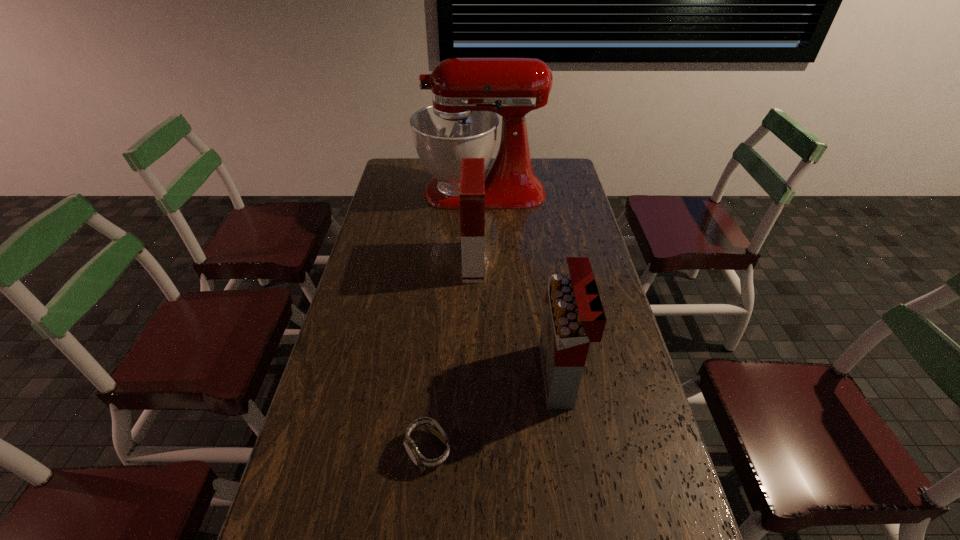
What are the coordinates of `free space at the left edge of the desktop` in the screenshot? It's located at (372, 357).

Find the location of a particular element. Image resolution: width=960 pixels, height=540 pixels. vacant position at the right edge of the desktop is located at coordinates (616, 423).

In the image, there is a desktop. Where is `blank space at the far left corner`? Image resolution: width=960 pixels, height=540 pixels. blank space at the far left corner is located at coordinates (403, 168).

The image size is (960, 540). Find the location of `free region at the far right corner of the desktop`. free region at the far right corner of the desktop is located at coordinates (555, 176).

The height and width of the screenshot is (540, 960). I want to click on vacant space that's between the left cigarette case and the nearest object, so click(451, 355).

Where is `vacant space that's between the tallest object and the right cigarette case`? vacant space that's between the tallest object and the right cigarette case is located at coordinates click(520, 284).

Locate an element on the screen. Image resolution: width=960 pixels, height=540 pixels. free space between the nearer cigarette case and the shortest object is located at coordinates (493, 412).

Where is `empty space that is in between the right cigarette case and the nearest object`? The height and width of the screenshot is (540, 960). empty space that is in between the right cigarette case and the nearest object is located at coordinates (493, 412).

Identify the location of vacant region between the farther cigarette case and the shortest object. (451, 355).

Find the location of `free space between the nearest object and the tallest object`. free space between the nearest object and the tallest object is located at coordinates (455, 320).